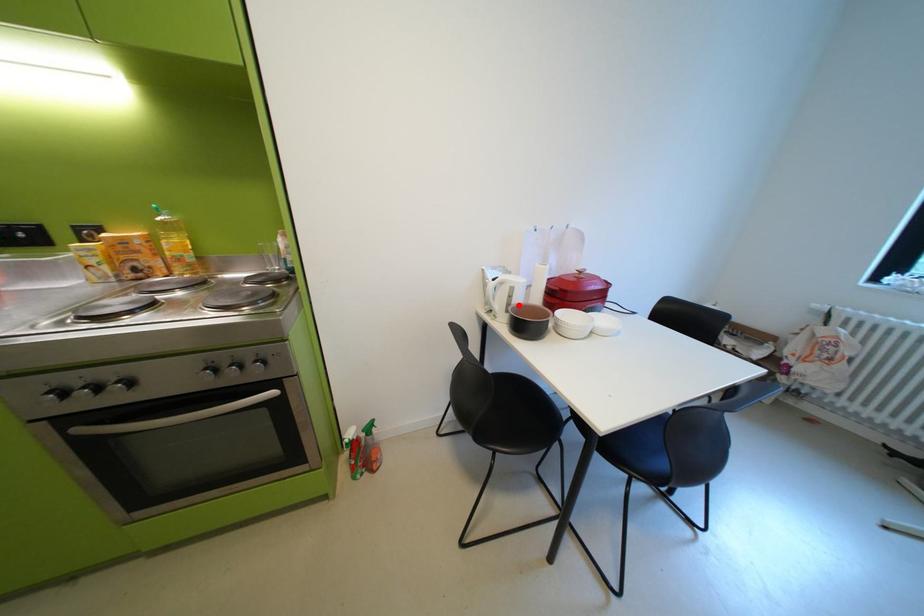
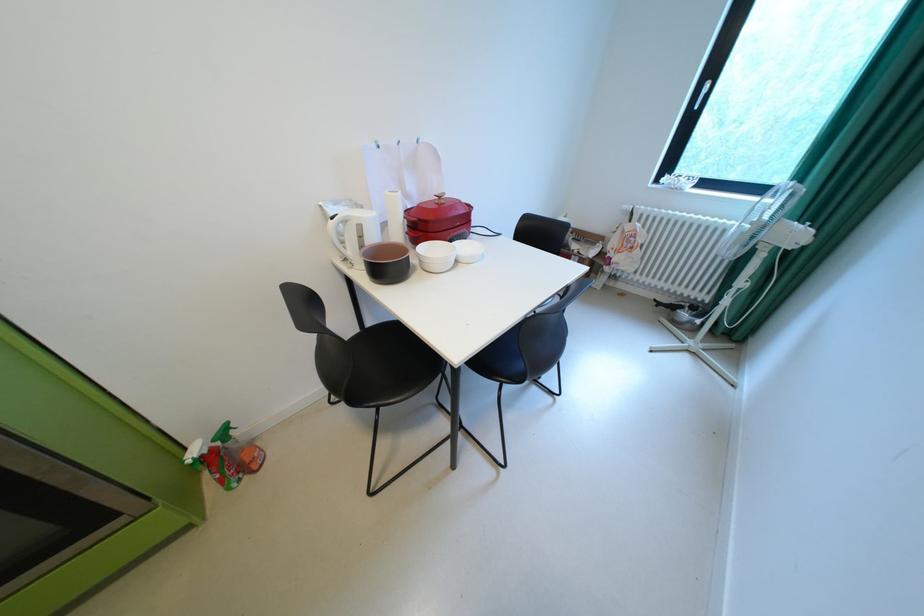
Where in the second image is the point corresponding to the highlighted location from the first image?

(371, 246)